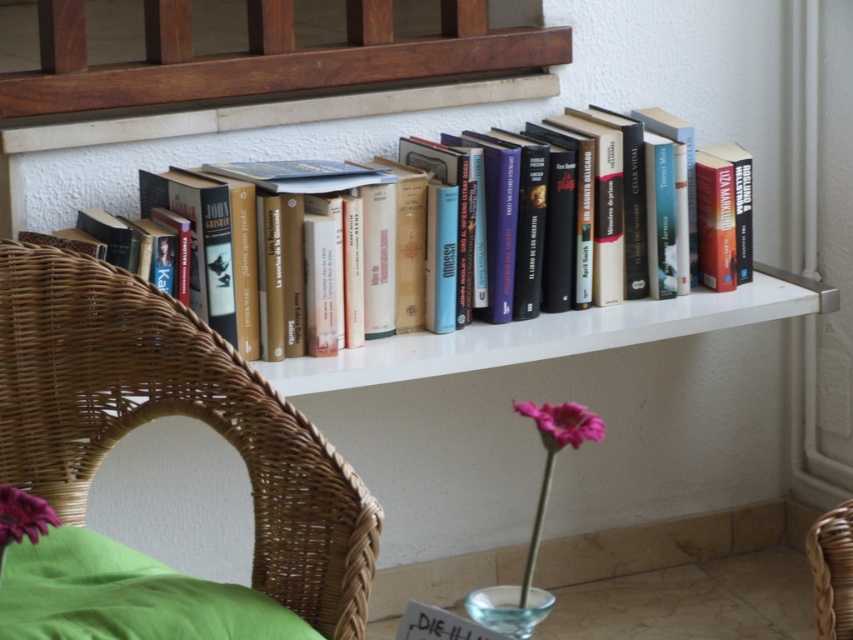
You are sitting in the wicker chair with a green cushion and want to reach both the wooden at upper center and the transparent glass vase at lower center. Which object can you easily reach without moving your chair?

The wooden at upper center is further to the viewer than the transparent glass vase at lower center, so you can easily reach the wooden at upper center without moving your chair.